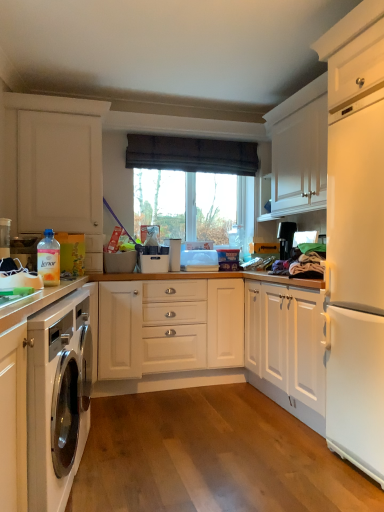
Question: Is white glossy cabinet at lower left, positioned as the first cabinetry in bottom-to-top order, not within transparent glass window at center?

Choices:
 (A) yes
 (B) no

Answer: (A)

Question: Does white glossy cabinet at lower left, which ranks as the 2th cabinetry in top-to-bottom order, have a larger size compared to transparent glass window at center?

Choices:
 (A) yes
 (B) no

Answer: (A)

Question: Does white glossy cabinet at lower left, positioned as the first cabinetry in bottom-to-top order, touch transparent glass window at center?

Choices:
 (A) yes
 (B) no

Answer: (B)

Question: From the image's perspective, is white glossy cabinet at lower left, positioned as the first cabinetry in bottom-to-top order, on top of transparent glass window at center?

Choices:
 (A) no
 (B) yes

Answer: (A)

Question: Is white glossy cabinet at lower left, which is the 1th cabinetry from front to back, positioned far away from transparent glass window at center?

Choices:
 (A) no
 (B) yes

Answer: (B)

Question: Can you confirm if white glossy cabinet at lower left, which is the 1th cabinetry from front to back, is wider than transparent glass window at center?

Choices:
 (A) yes
 (B) no

Answer: (A)

Question: Considering the relative sizes of translucent plastic bottle at lower left and black plastic coffee maker at upper right in the image provided, is translucent plastic bottle at lower left taller than black plastic coffee maker at upper right?

Choices:
 (A) no
 (B) yes

Answer: (A)

Question: Is translucent plastic bottle at lower left thinner than black plastic coffee maker at upper right?

Choices:
 (A) no
 (B) yes

Answer: (B)

Question: Can you confirm if translucent plastic bottle at lower left is shorter than black plastic coffee maker at upper right?

Choices:
 (A) yes
 (B) no

Answer: (A)

Question: From a real-world perspective, is translucent plastic bottle at lower left over black plastic coffee maker at upper right?

Choices:
 (A) no
 (B) yes

Answer: (A)

Question: Is translucent plastic bottle at lower left next to black plastic coffee maker at upper right and touching it?

Choices:
 (A) yes
 (B) no

Answer: (B)

Question: Does translucent plastic bottle at lower left appear on the left side of black plastic coffee maker at upper right?

Choices:
 (A) yes
 (B) no

Answer: (A)

Question: Could white matte cabinet at left, marked as the 1th cabinetry in a back-to-front arrangement, be considered to be inside dark brown fabric at upper center?

Choices:
 (A) yes
 (B) no

Answer: (B)